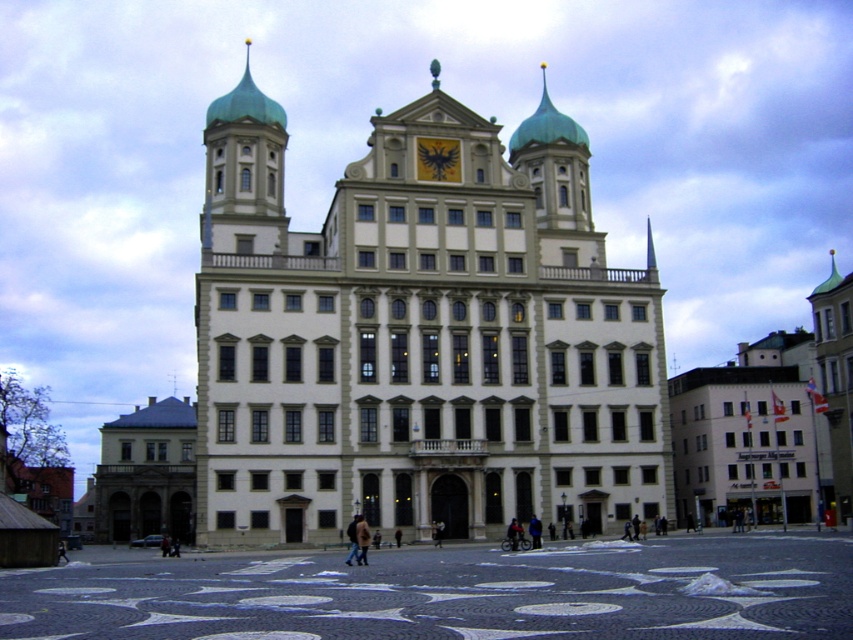
Question: Among these objects, which one is farthest from the camera?

Choices:
 (A) white stone building at center
 (B) gold metallic clock at center

Answer: (B)

Question: Does white stone building at center have a lesser width compared to gold metallic clock at center?

Choices:
 (A) yes
 (B) no

Answer: (B)

Question: Which of the following is the closest to the observer?

Choices:
 (A) (248, 253)
 (B) (425, 144)

Answer: (A)

Question: Is white stone building at center bigger than gold metallic clock at center?

Choices:
 (A) yes
 (B) no

Answer: (A)

Question: Which point is farther to the camera?

Choices:
 (A) (439, 177)
 (B) (614, 432)

Answer: (A)

Question: In this image, where is white stone building at center located relative to gold metallic clock at center?

Choices:
 (A) right
 (B) left

Answer: (A)